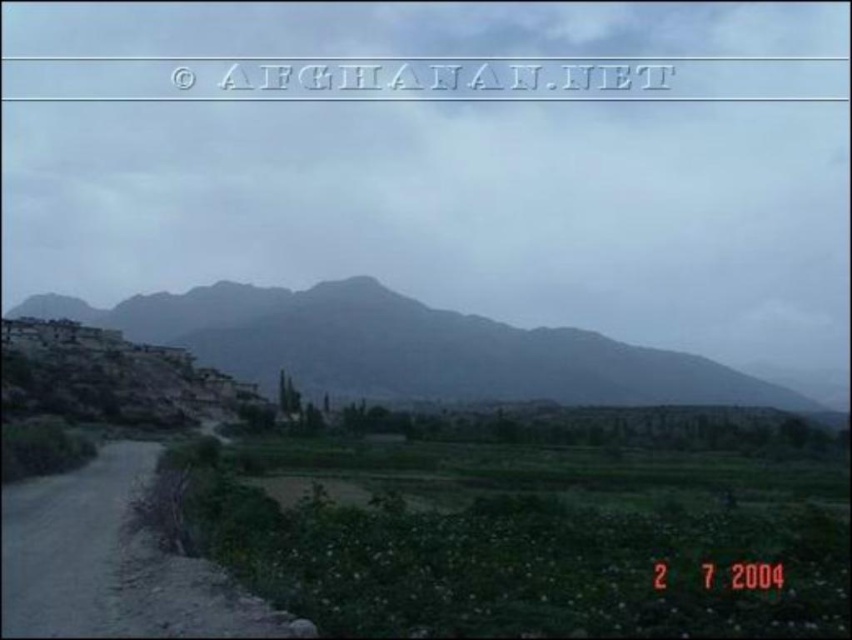
Who is more distant from viewer, (525, 352) or (3, 513)?

The point (525, 352) is behind.

Is the position of dark gray rock at center more distant than that of dirt road at lower left?

Yes, it is behind dirt road at lower left.

Between point (435, 374) and point (72, 524), which one is positioned behind?

The point (435, 374) is more distant.

I want to click on dark gray rock at center, so click(x=410, y=348).